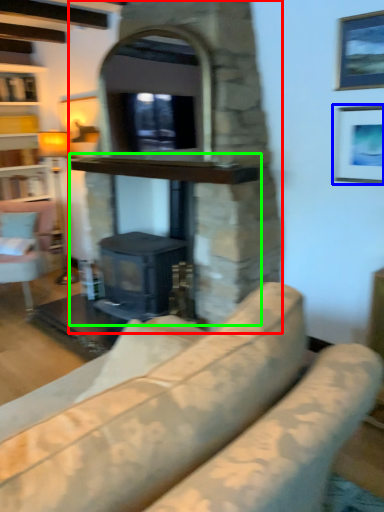
Question: Which object is the closest to the fireplace (highlighted by a red box)? Choose among these: picture frame (highlighted by a blue box) or fireplace (highlighted by a green box).

Choices:
 (A) picture frame
 (B) fireplace

Answer: (B)